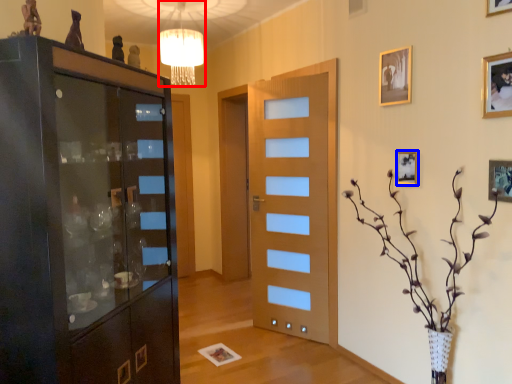
Question: Which object appears farthest to the camera in this image, lamp (highlighted by a red box) or picture frame (highlighted by a blue box)?

Choices:
 (A) lamp
 (B) picture frame

Answer: (A)